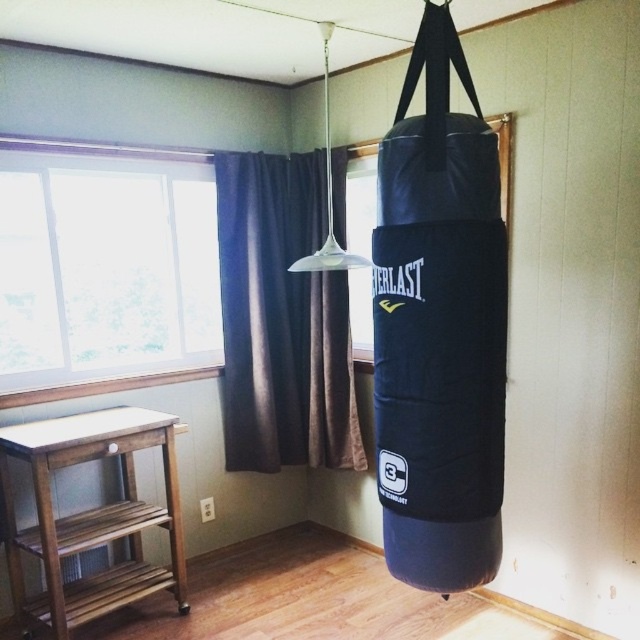
Question: Where is transparent glass window at upper left located in relation to dark velvet curtain at center in the image?

Choices:
 (A) above
 (B) below

Answer: (A)

Question: Which of the following is the farthest from the observer?

Choices:
 (A) dark velvet curtain at center
 (B) transparent glass window at center

Answer: (A)

Question: Which is farther from the transparent glass window at center?

Choices:
 (A) dark velvet curtain at center
 (B) transparent glass window at upper left

Answer: (B)

Question: Among these objects, which one is farthest from the camera?

Choices:
 (A) transparent glass window at upper left
 (B) transparent glass window at center
 (C) dark velvet curtain at center

Answer: (C)

Question: Can you confirm if transparent glass window at upper left is thinner than transparent glass window at center?

Choices:
 (A) yes
 (B) no

Answer: (B)

Question: Is the position of transparent glass window at upper left more distant than that of dark velvet curtain at center?

Choices:
 (A) no
 (B) yes

Answer: (A)